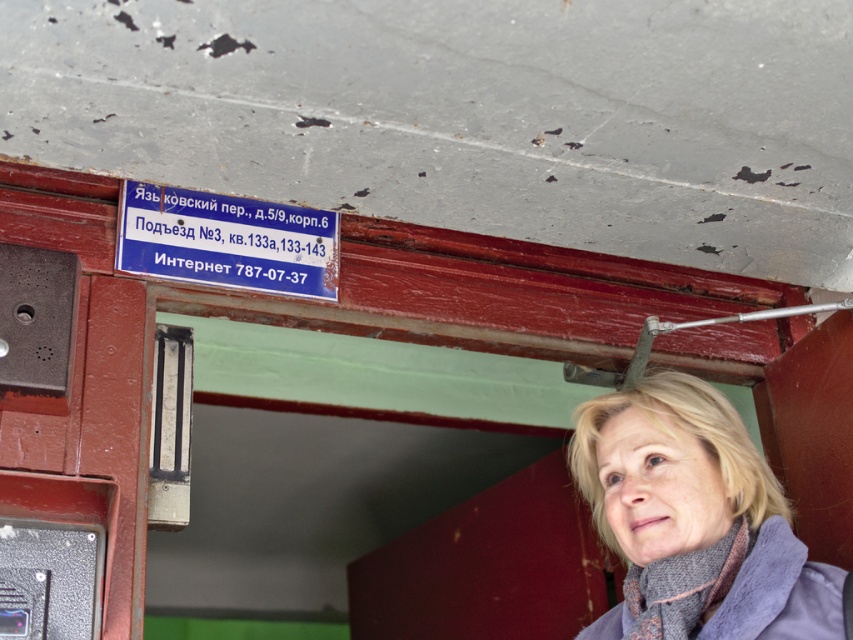
You are standing in front of the door frame and notice the blonde hair at upper right and the blue plastic sign at upper center. Which object is closer to the ceiling?

The blue plastic sign at upper center is closer to the ceiling because it is positioned above the blonde hair at upper right.

You are standing in front of the door frame and want to make a phone call. The black textured phone box at lower left requires a certain amount of space to access. Considering the size of the blonde hair at upper right, can you estimate if the phone box will be easy to reach?

The blonde hair at upper right is wider than the black textured phone box at lower left. Since the phone box is narrower, it should be easier to reach and access for making a call.

You are standing in the building and see two points marked in the scene. The first point is at coordinate point (306, 230) and the second is at point (15, 625). Which point is closer to you?

Point (15, 625) is closer to you because it is in front of point (306, 230).